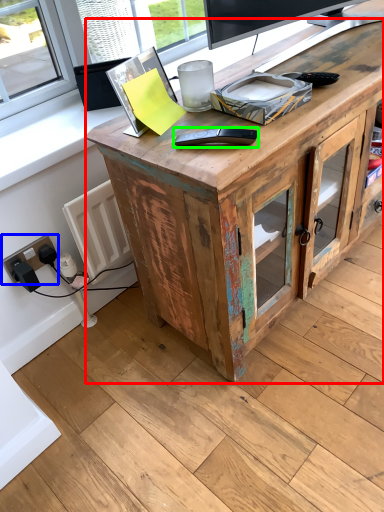
Question: Which object is the closest to the desk (highlighted by a red box)? Choose among these: electric outlet (highlighted by a blue box) or equipment (highlighted by a green box).

Choices:
 (A) electric outlet
 (B) equipment

Answer: (B)